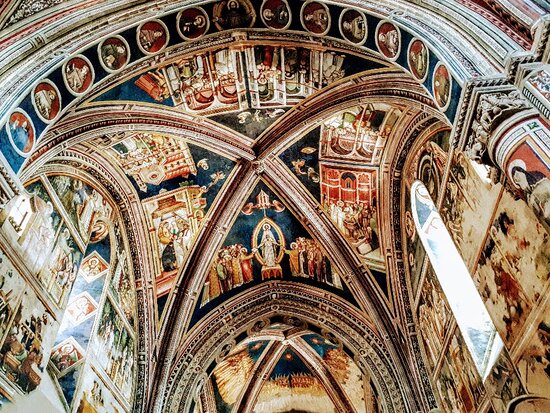
At what (x,y) coordinates should I click in order to perform the action: click on light. Please return your answer as a coordinate pair (x, y). The width and height of the screenshot is (550, 413). Looking at the image, I should click on (452, 273), (75, 320).